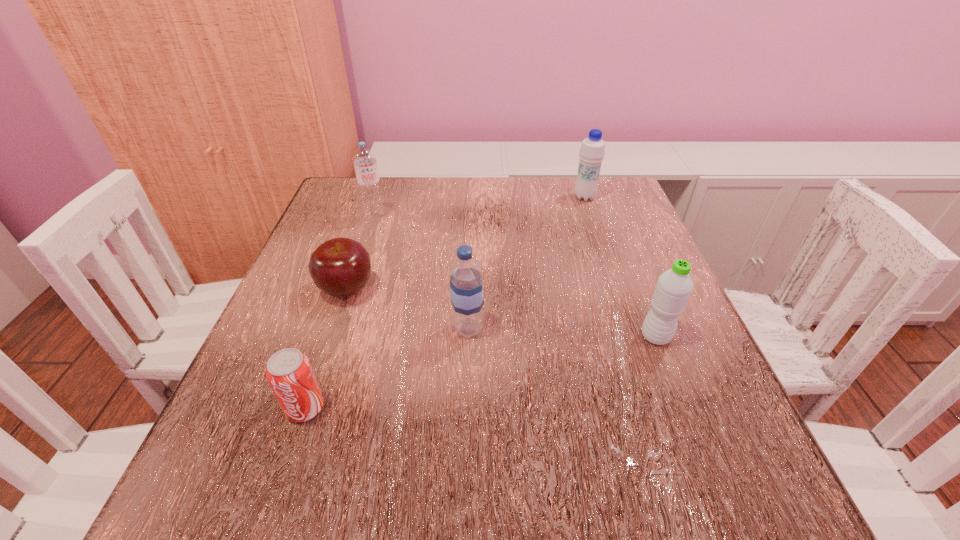
Locate an element on the screen. free space at the far left corner is located at coordinates (361, 217).

Identify the location of vacant region at the near left corner of the desktop. (269, 460).

I want to click on vacant space at the near right corner of the desktop, so click(x=665, y=501).

The height and width of the screenshot is (540, 960). What are the coordinates of `unoccupied area between the third water bottle from right to left and the nearest object` in the screenshot? It's located at [387, 368].

This screenshot has width=960, height=540. I want to click on free space between the nearest object and the second water bottle from left to right, so click(387, 368).

Find the location of a particular element. The width and height of the screenshot is (960, 540). free area in between the farthest object and the soda can is located at coordinates click(444, 302).

Find the location of a particular element. The width and height of the screenshot is (960, 540). empty location between the leftmost water bottle and the fourth object from left to right is located at coordinates (421, 273).

You are a GUI agent. You are given a task and a screenshot of the screen. Output one action in this format:
    pyautogui.click(x=<x>, y=<y>)
    Task: Click on the empty location between the third object from right to left and the fourth nearest object
    The height and width of the screenshot is (540, 960).
    Given the screenshot: What is the action you would take?
    pyautogui.click(x=407, y=309)

Identify the location of object that is the second closest to the leftmost water bottle. The image size is (960, 540). (466, 288).

Locate which object ranks in proximity to the fourth object from left to right. Please provide its 2D coordinates. Your answer should be formatted as a tuple, i.e. [(x, y)], where the tuple contains the x and y coordinates of a point satisfying the conditions above.

[(340, 267)]